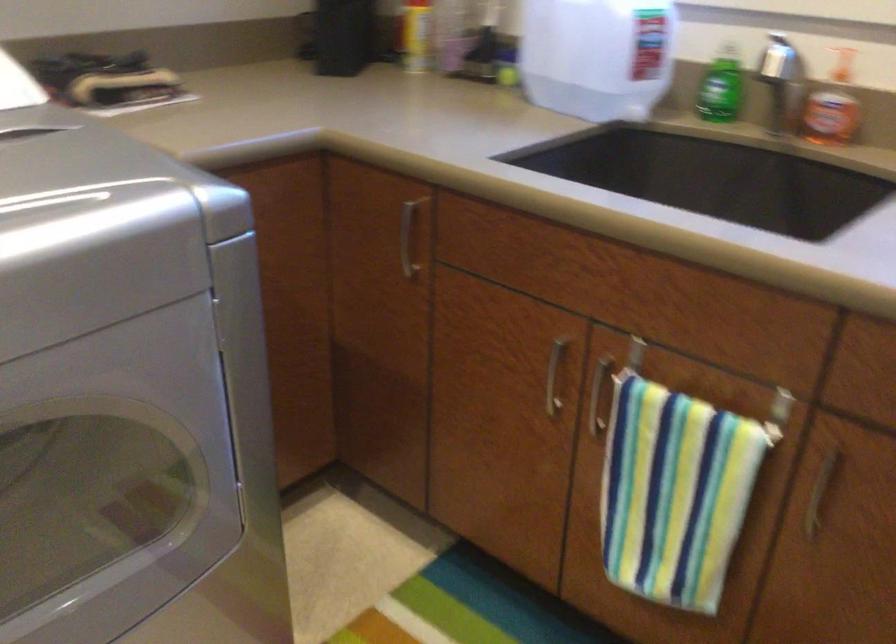
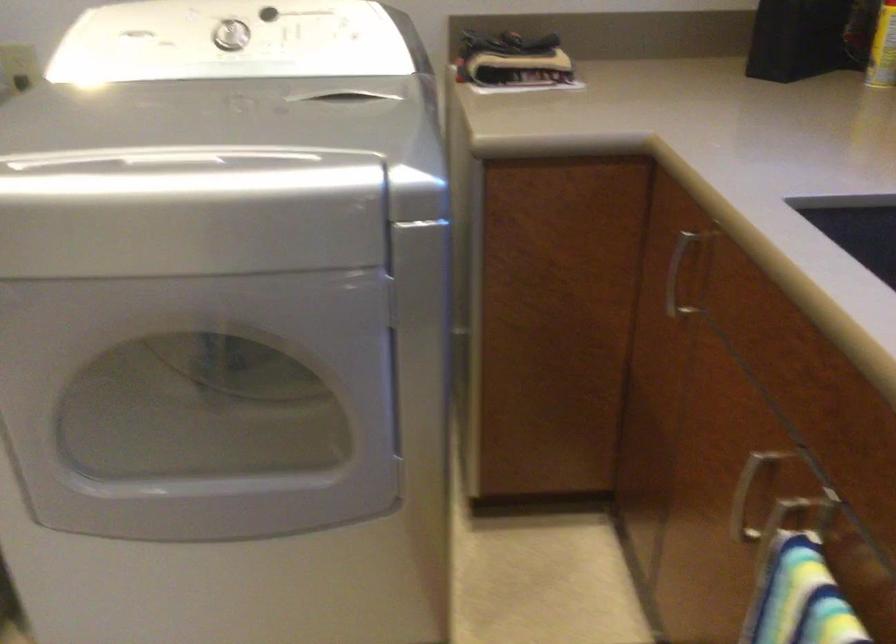
In the second image, find the point that corresponds to (x=391, y=242) in the first image.

(677, 275)